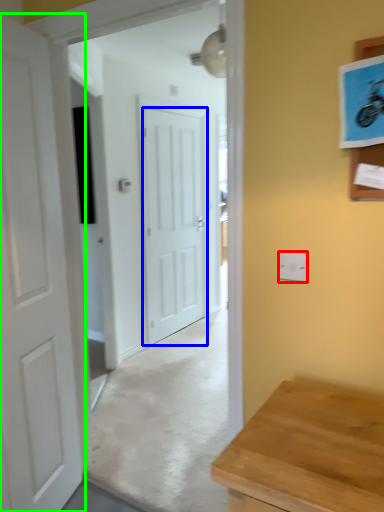
Question: Estimate the real-world distances between objects in this image. Which object is closer to electric outlet (highlighted by a red box), door (highlighted by a blue box) or door (highlighted by a green box)?

Choices:
 (A) door
 (B) door

Answer: (B)